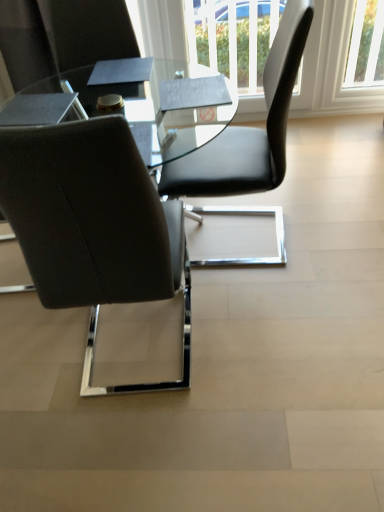
Where is `spots to the right of matte black chair at left, the 1th chair when ordered from left to right`? spots to the right of matte black chair at left, the 1th chair when ordered from left to right is located at coordinates (261, 345).